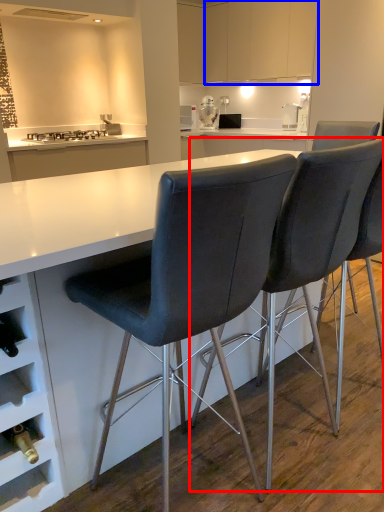
Question: Among these objects, which one is farthest to the camera, chair (highlighted by a red box) or cabinetry (highlighted by a blue box)?

Choices:
 (A) chair
 (B) cabinetry

Answer: (B)